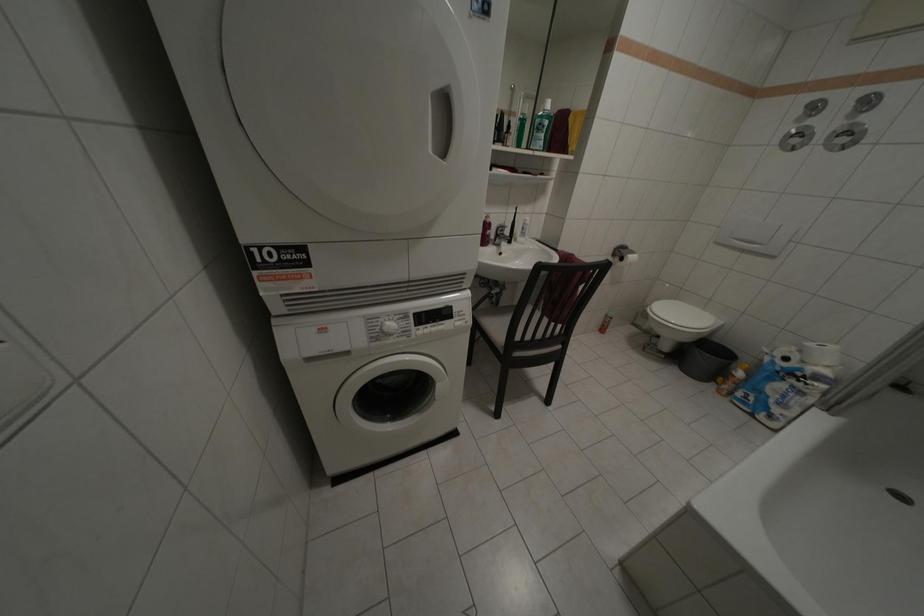
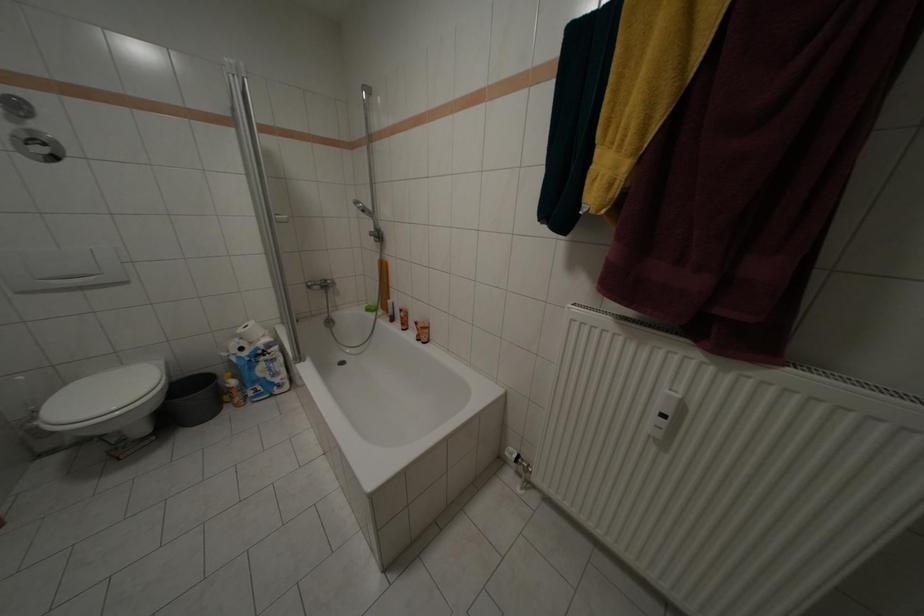
First-person continuous shooting, in which direction is the camera rotating?

The camera rotated toward right-down.